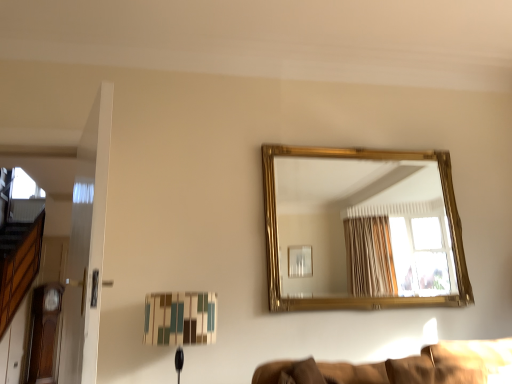
The image size is (512, 384). What do you see at coordinates (429, 365) in the screenshot?
I see `brown fabric couch at lower right` at bounding box center [429, 365].

Where is `gold/gilded mirror at upper center`? The height and width of the screenshot is (384, 512). gold/gilded mirror at upper center is located at coordinates (362, 216).

From a real-world perspective, is matte plastic table lamp at lower center located higher than brown fabric couch at lower right?

Correct, in the physical world, matte plastic table lamp at lower center is higher than brown fabric couch at lower right.

Is matte plastic table lamp at lower center placed right next to brown fabric couch at lower right?

No, matte plastic table lamp at lower center is not with brown fabric couch at lower right.

In the scene shown: Do you think matte plastic table lamp at lower center is within brown fabric couch at lower right, or outside of it?

matte plastic table lamp at lower center lies outside brown fabric couch at lower right.

Is point (400, 182) behind point (161, 296)?

That is True.

Is gold/gilded mirror at upper center not inside matte plastic table lamp at lower center?

gold/gilded mirror at upper center lies outside matte plastic table lamp at lower center's area.

From the image's perspective, which object appears higher, gold/gilded mirror at upper center or matte plastic table lamp at lower center?

gold/gilded mirror at upper center is shown above in the image.

Which is less distant, (413, 383) or (407, 246)?

Point (413, 383)

Is brown fabric couch at lower right with gold/gilded mirror at upper center?

brown fabric couch at lower right and gold/gilded mirror at upper center are clearly separated.

Is brown fabric couch at lower right closer to camera compared to gold/gilded mirror at upper center?

Yes, it is.

Can you confirm if brown fabric couch at lower right is taller than gold/gilded mirror at upper center?

In fact, brown fabric couch at lower right may be shorter than gold/gilded mirror at upper center.

Is matte plastic table lamp at lower center not close to gold/gilded mirror at upper center?

Yes, matte plastic table lamp at lower center and gold/gilded mirror at upper center are located far from each other.

Which object is wider, matte plastic table lamp at lower center or gold/gilded mirror at upper center?

matte plastic table lamp at lower center is wider.

Is point (202, 335) positioned after point (331, 237)?

No, it is not.

From the image's perspective, is matte plastic table lamp at lower center under gold/gilded mirror at upper center?

Yes, from the image's perspective, matte plastic table lamp at lower center is beneath gold/gilded mirror at upper center.

From a real-world perspective, is brown fabric couch at lower right physically above matte plastic table lamp at lower center?

Incorrect, from a real-world perspective, brown fabric couch at lower right is lower than matte plastic table lamp at lower center.

Is brown fabric couch at lower right surrounding matte plastic table lamp at lower center?

That's incorrect, matte plastic table lamp at lower center is not inside brown fabric couch at lower right.

Is brown fabric couch at lower right bigger than matte plastic table lamp at lower center?

No.

Can you confirm if brown fabric couch at lower right is positioned to the right of matte plastic table lamp at lower center?

Indeed, brown fabric couch at lower right is positioned on the right side of matte plastic table lamp at lower center.

Can you confirm if gold/gilded mirror at upper center is thinner than brown fabric couch at lower right?

Yes.

Which object is positioned more to the left, gold/gilded mirror at upper center or brown fabric couch at lower right?

brown fabric couch at lower right.

Between gold/gilded mirror at upper center and brown fabric couch at lower right, which one has more height?

Standing taller between the two is gold/gilded mirror at upper center.

Do you think gold/gilded mirror at upper center is within brown fabric couch at lower right, or outside of it?

gold/gilded mirror at upper center is not enclosed by brown fabric couch at lower right.

In order to click on couch to the right of matte plastic table lamp at lower center in this screenshot , I will do `click(429, 365)`.

Where is `table lamp directly beneath the gold/gilded mirror at upper center (from a real-world perspective)`? table lamp directly beneath the gold/gilded mirror at upper center (from a real-world perspective) is located at coordinates (180, 318).

Looking at the image, which one is located further to matte plastic table lamp at lower center, brown fabric couch at lower right or gold/gilded mirror at upper center?

gold/gilded mirror at upper center lies further to matte plastic table lamp at lower center than the other object.

When comparing their distances from gold/gilded mirror at upper center, does brown fabric couch at lower right or matte plastic table lamp at lower center seem further?

brown fabric couch at lower right lies further to gold/gilded mirror at upper center than the other object.

In the scene shown: Looking at the image, which one is located closer to gold/gilded mirror at upper center, matte plastic table lamp at lower center or brown fabric couch at lower right?

matte plastic table lamp at lower center is positioned closer to the anchor gold/gilded mirror at upper center.

From the image, which object appears to be nearer to brown fabric couch at lower right, gold/gilded mirror at upper center or matte plastic table lamp at lower center?

Based on the image, matte plastic table lamp at lower center appears to be nearer to brown fabric couch at lower right.

Considering their positions, is gold/gilded mirror at upper center positioned further to matte plastic table lamp at lower center than brown fabric couch at lower right?

Based on the image, gold/gilded mirror at upper center appears to be further to matte plastic table lamp at lower center.

Based on their spatial positions, is matte plastic table lamp at lower center or gold/gilded mirror at upper center closer to brown fabric couch at lower right?

matte plastic table lamp at lower center.

Locate an element on the screen. couch between matte plastic table lamp at lower center and gold/gilded mirror at upper center is located at coordinates (429, 365).